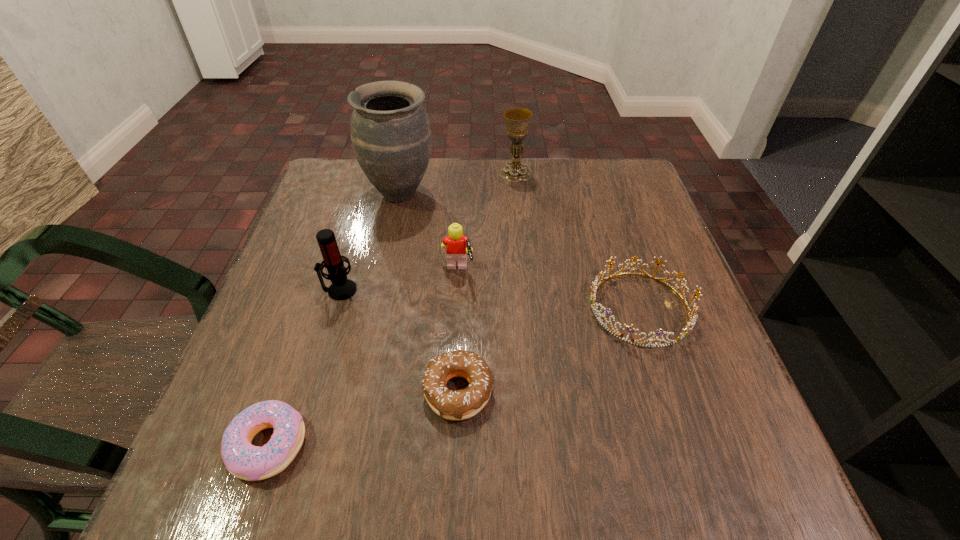
Image resolution: width=960 pixels, height=540 pixels. Identify the location of the tallest object. (390, 131).

Locate an element on the screen. chalice is located at coordinates (517, 120).

Identify the location of microphone. This screenshot has height=540, width=960. (342, 288).

Identify the location of Lego. The image size is (960, 540). (458, 245).

Image resolution: width=960 pixels, height=540 pixels. Identify the location of the rightmost object. (594, 287).

Identify the location of tiara. The image size is (960, 540). (594, 287).

This screenshot has width=960, height=540. I want to click on the right doughnut, so [x=462, y=404].

This screenshot has height=540, width=960. I want to click on the left doughnut, so 242,459.

Find the location of `vacant region located 0.080m on the front of the urn`. vacant region located 0.080m on the front of the urn is located at coordinates (391, 237).

At what (x,y) coordinates should I click in order to perform the action: click on free space located on the front of the chalice. Please return your answer as a coordinate pair (x, y). Looking at the image, I should click on (518, 198).